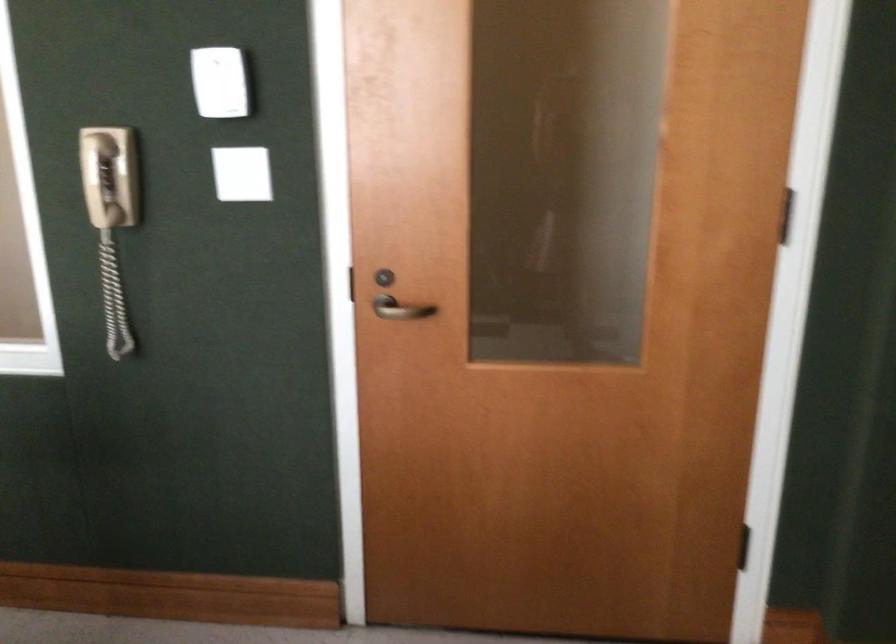
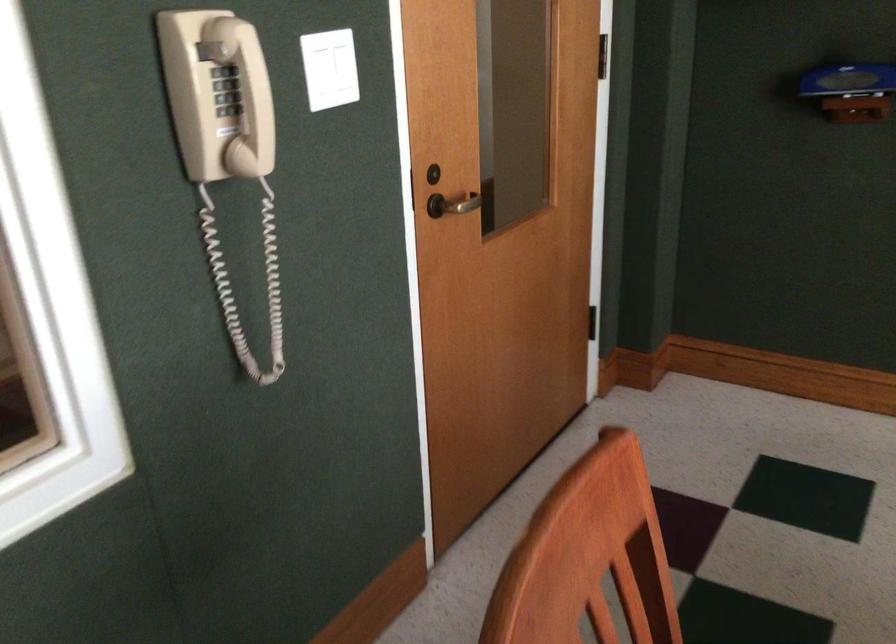
Find the pixel in the second image that matches point (101, 183) in the first image.

(226, 90)